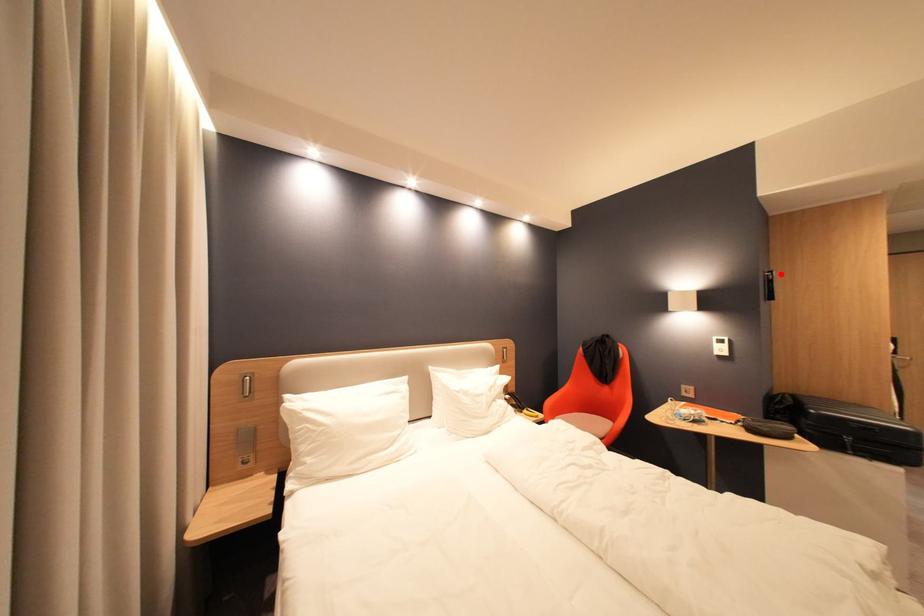
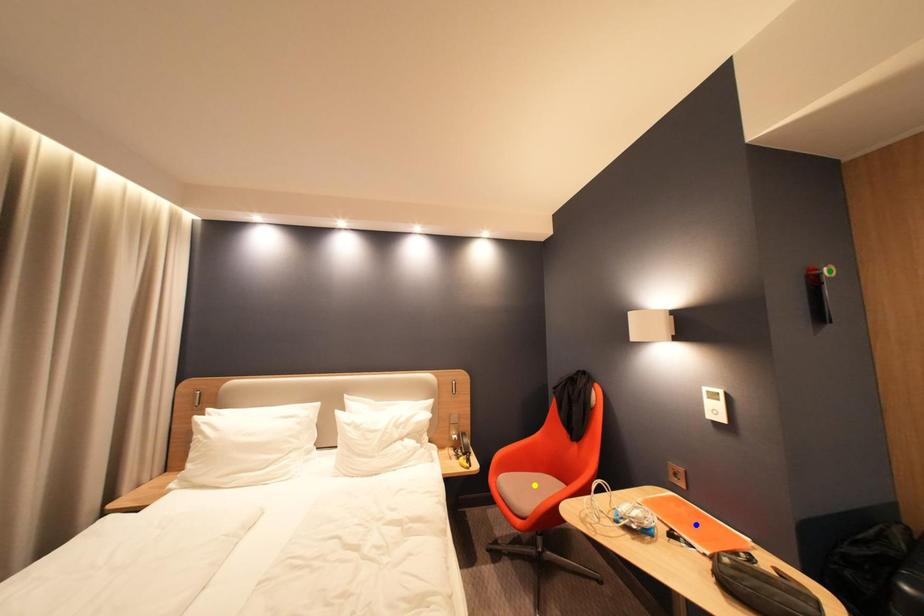
Question: I am providing you with two images of the same scene from different viewpoints. A red point is marked on the first image. You are given multiple points on the second image. In image 2, which mark is for the same physical point as the one in image 1?

Choices:
 (A) green point
 (B) blue point
 (C) yellow point

Answer: (A)